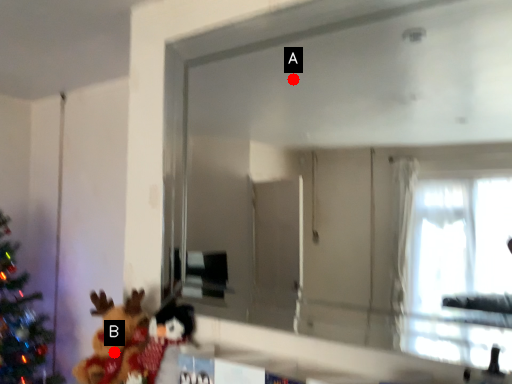
Question: Two points are circled on the image, labeled by A and B beside each circle. Which point is further to the camera?

Choices:
 (A) A is further
 (B) B is further

Answer: (B)